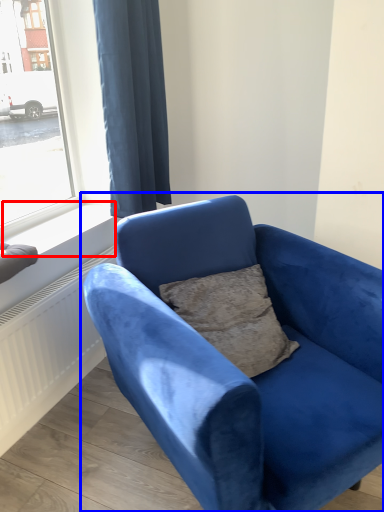
Question: Among these objects, which one is nearest to the camera, window sill (highlighted by a red box) or studio couch (highlighted by a blue box)?

Choices:
 (A) window sill
 (B) studio couch

Answer: (B)